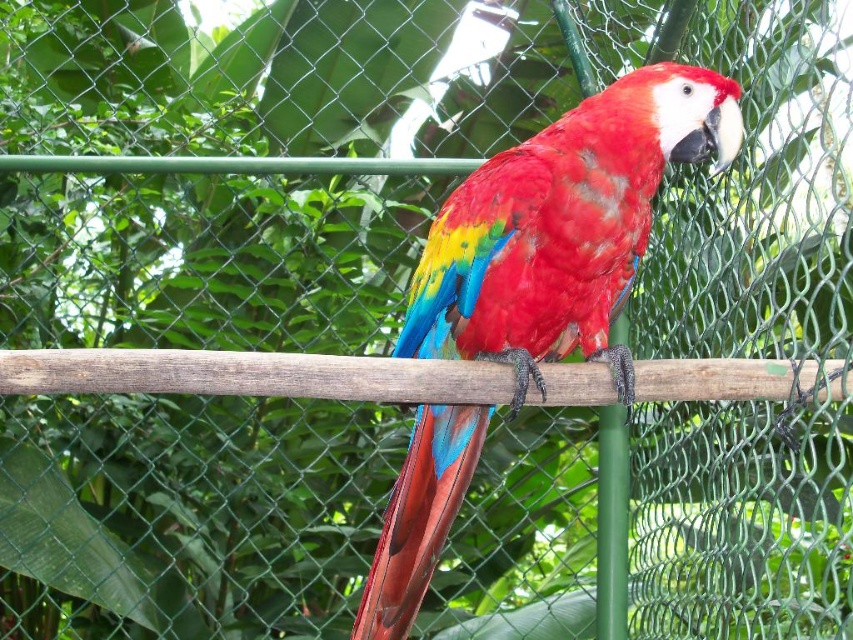
Is shiny red parrot at center to the left of wooden pole at center from the viewer's perspective?

Incorrect, shiny red parrot at center is not on the left side of wooden pole at center.

Is the position of shiny red parrot at center less distant than that of wooden pole at center?

That is False.

Image resolution: width=853 pixels, height=640 pixels. What do you see at coordinates (563, 227) in the screenshot?
I see `shiny red parrot at center` at bounding box center [563, 227].

This screenshot has height=640, width=853. I want to click on shiny red parrot at center, so click(563, 227).